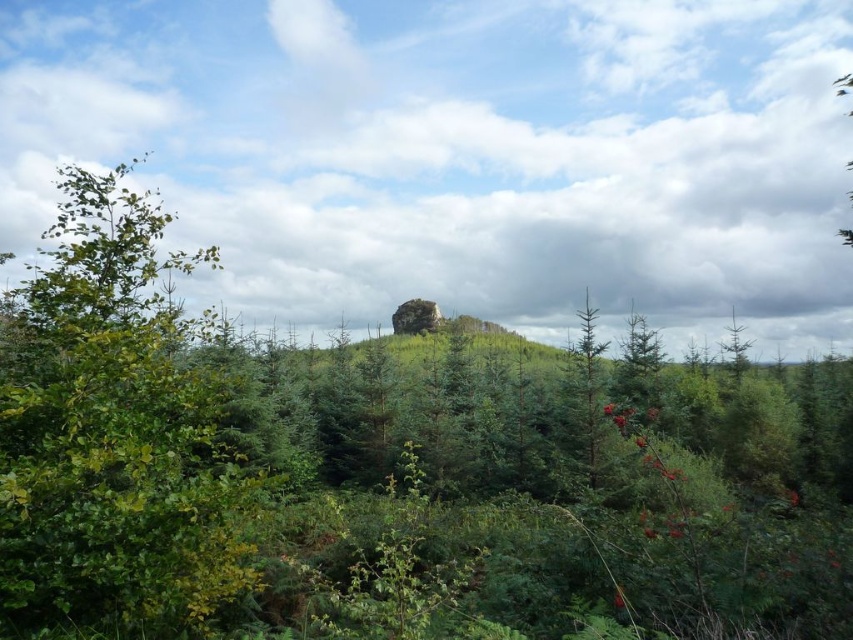
Question: Can you confirm if white fluffy cloud at upper center is positioned to the left of green matte tree at center?

Choices:
 (A) no
 (B) yes

Answer: (A)

Question: Does white fluffy cloud at upper center have a lesser width compared to green leafy tree at left?

Choices:
 (A) no
 (B) yes

Answer: (A)

Question: Which of the following is the closest to the observer?

Choices:
 (A) (581, 406)
 (B) (799, 122)

Answer: (A)

Question: Does white fluffy cloud at upper center have a larger size compared to green matte tree at center?

Choices:
 (A) no
 (B) yes

Answer: (B)

Question: Estimate the real-world distances between objects in this image. Which object is farther from the green matte tree at center?

Choices:
 (A) green leafy tree at left
 (B) white fluffy cloud at upper center

Answer: (B)

Question: Which point is farther to the camera?

Choices:
 (A) green matte tree at center
 (B) green leafy tree at left
 (C) white fluffy cloud at upper center

Answer: (A)